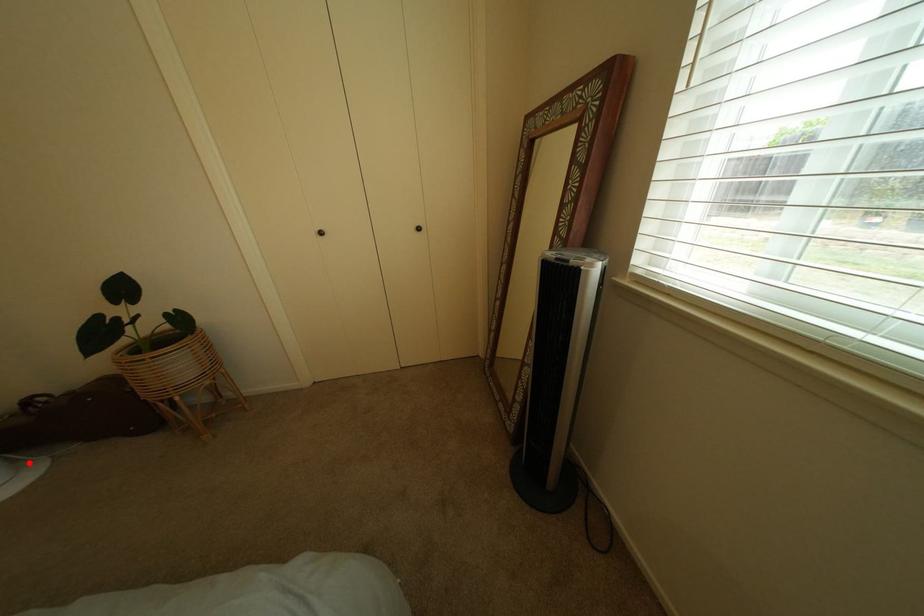
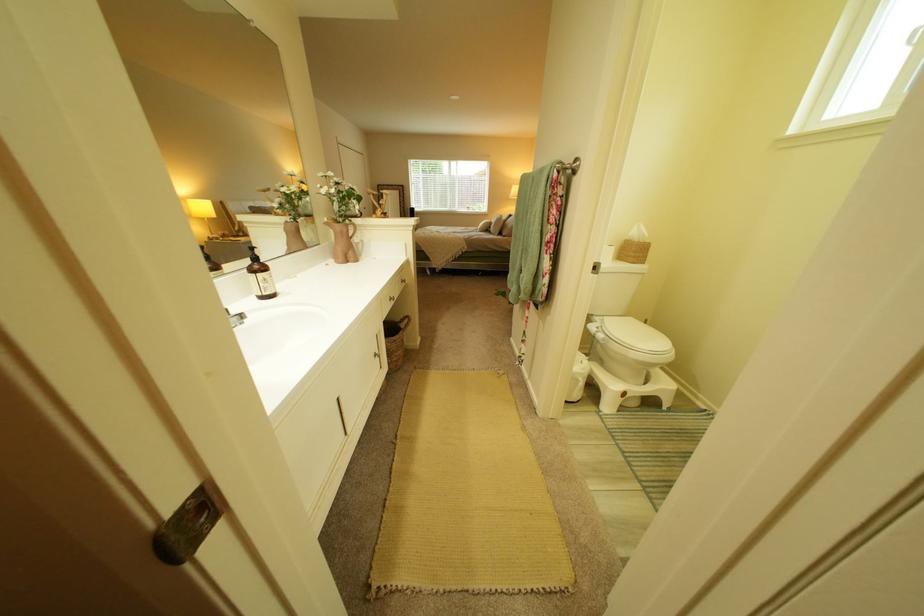
Question: I am providing you with two images of the same scene from different viewpoints. A red point is marked on the first image. At the location where the point appears in image 1, is it still visible in image 2?

Choices:
 (A) Yes
 (B) No

Answer: (B)